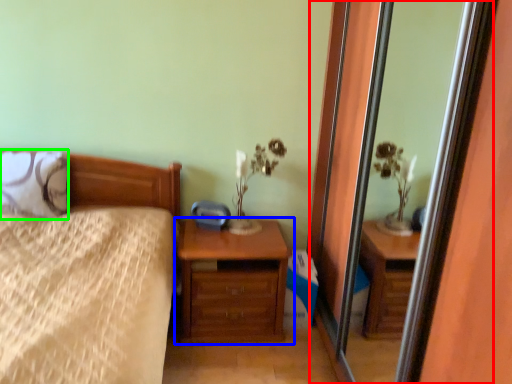
Question: Which is nearer to the screen door (highlighted by a red box)? chest of drawers (highlighted by a blue box) or pillow (highlighted by a green box).

Choices:
 (A) chest of drawers
 (B) pillow

Answer: (A)